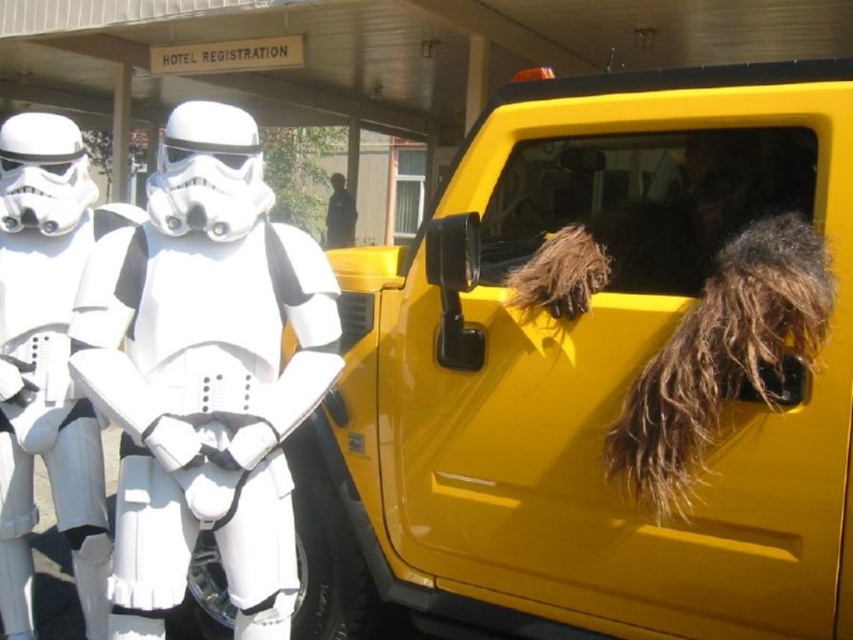
Question: Is yellow matte car at right wider than white plastic stormtrooper at left?

Choices:
 (A) no
 (B) yes

Answer: (B)

Question: Is yellow matte car at right to the right of white plastic stormtrooper at left from the viewer's perspective?

Choices:
 (A) no
 (B) yes

Answer: (B)

Question: Does yellow matte car at right appear on the right side of white matte stormtrooper at center?

Choices:
 (A) no
 (B) yes

Answer: (B)

Question: Which point appears closest to the camera in this image?

Choices:
 (A) (107, 547)
 (B) (167, 420)

Answer: (B)

Question: Which of these objects is positioned farthest from the white matte stormtrooper at center?

Choices:
 (A) white plastic stormtrooper at left
 (B) yellow matte car at right

Answer: (A)

Question: Which of the following is the farthest from the observer?

Choices:
 (A) white plastic stormtrooper at left
 (B) white matte stormtrooper at center

Answer: (A)